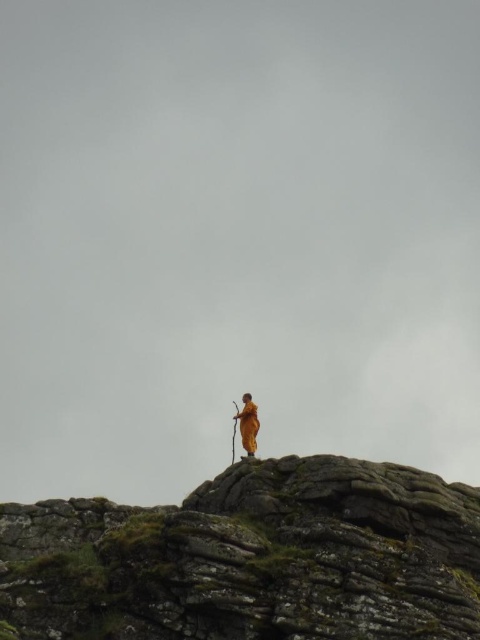
Between mossy rock at center and golden fabric statue at center, which one is positioned higher?

golden fabric statue at center

Is mossy rock at center positioned at the back of golden fabric statue at center?

No, mossy rock at center is closer to the viewer.

Between point (367, 616) and point (251, 452), which one is positioned behind?

The point (251, 452) is more distant.

What are the coordinates of `mossy rock at center` in the screenshot? It's located at (253, 557).